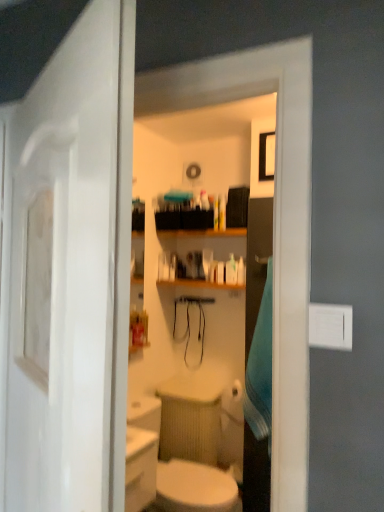
Question: Considering the positions of blue fabric towel at right and white glossy sink at lower center in the image, is blue fabric towel at right taller or shorter than white glossy sink at lower center?

Choices:
 (A) tall
 (B) short

Answer: (A)

Question: From the image's perspective, is blue fabric towel at right above or below white glossy sink at lower center?

Choices:
 (A) above
 (B) below

Answer: (A)

Question: Based on their relative distances, which object is farther from the white glossy door at left?

Choices:
 (A) blue fabric towel at right
 (B) white glossy sink at lower center

Answer: (A)

Question: Considering the real-world distances, which object is closest to the white glossy door at left?

Choices:
 (A) blue fabric towel at right
 (B) white glossy sink at lower center

Answer: (B)